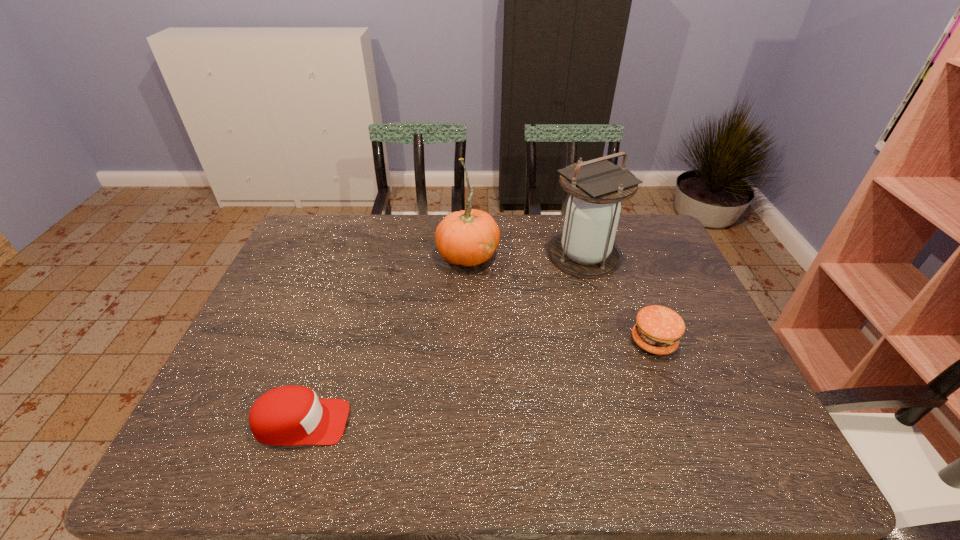
Identify the location of vacant area at the near right corner of the desktop. The image size is (960, 540). (774, 467).

At what (x,y) coordinates should I click in order to perform the action: click on free spot between the patty and the third object from right to left. Please return your answer as a coordinate pair (x, y). This screenshot has height=540, width=960. Looking at the image, I should click on (561, 298).

At what (x,y) coordinates should I click in order to perform the action: click on empty location between the tallest object and the patty. Please return your answer as a coordinate pair (x, y). Image resolution: width=960 pixels, height=540 pixels. Looking at the image, I should click on (618, 299).

Image resolution: width=960 pixels, height=540 pixels. I want to click on empty location between the leftmost object and the third object from right to left, so click(385, 339).

Where is `empty space that is in between the third farthest object and the third object from right to left`? Image resolution: width=960 pixels, height=540 pixels. empty space that is in between the third farthest object and the third object from right to left is located at coordinates (561, 298).

What are the coordinates of `free space between the leftmost object and the tallest object` in the screenshot? It's located at (443, 340).

Locate an element on the screen. The width and height of the screenshot is (960, 540). free space between the tallest object and the second tallest object is located at coordinates (526, 255).

At what (x,y) coordinates should I click in order to perform the action: click on vacant region between the second nearest object and the lantern. Please return your answer as a coordinate pair (x, y). Looking at the image, I should click on (618, 299).

What are the coordinates of `vacant region between the pumpkin and the second nearest object` in the screenshot? It's located at (561, 298).

In order to click on vacant area that lies between the lantern and the nearest object in this screenshot , I will do click(x=443, y=340).